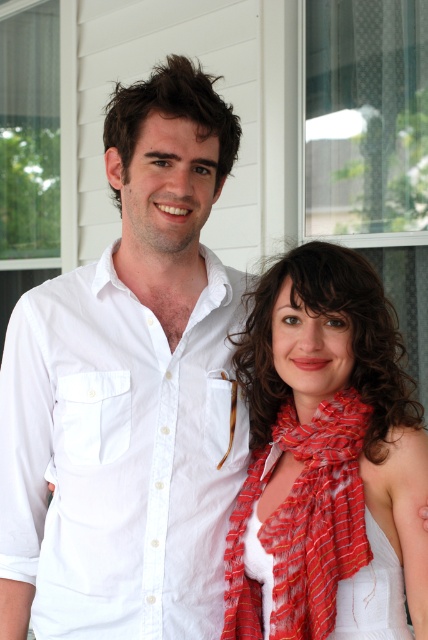
You are a photographer trying to capture a closeup shot of both the red striped scarf at center and the white satin dress at lower right. Given the distance between them, will you need to adjust your camera lens to a wider angle to ensure both are fully visible in the frame?

The distance between the red striped scarf at center and the white satin dress at lower right is 6.79 inches. To capture both in the same frame, you would need to adjust your camera lens to a wider angle to accommodate the space between them.

You are standing at point (252, 602) and want to take a photo of the two people in the scene. If your camera has a focal length of 50mm and you want to capture both individuals in frame without moving, what is the minimum distance you should be from the point to ensure both are fully visible?

The minimum distance should be 1.58 meters because the point and camera are 1.58 meters apart, so staying at that distance ensures both people are in frame without moving.

You are a fashion designer observing the two scarves in the image. Which scarf, the red striped scarf at center or the striped silk scarf at center, has a greater width?

The red striped scarf at center is wider than the striped silk scarf at center according to the description.